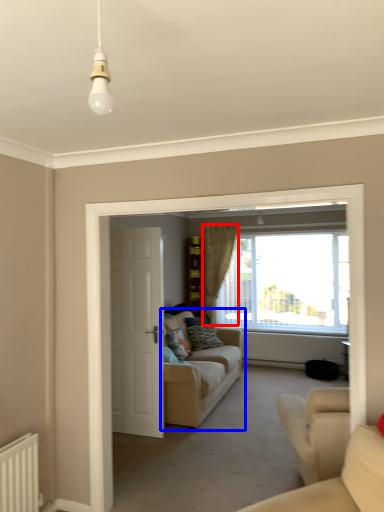
Question: Which point is further to the camera, curtain (highlighted by a red box) or studio couch (highlighted by a blue box)?

Choices:
 (A) curtain
 (B) studio couch

Answer: (A)